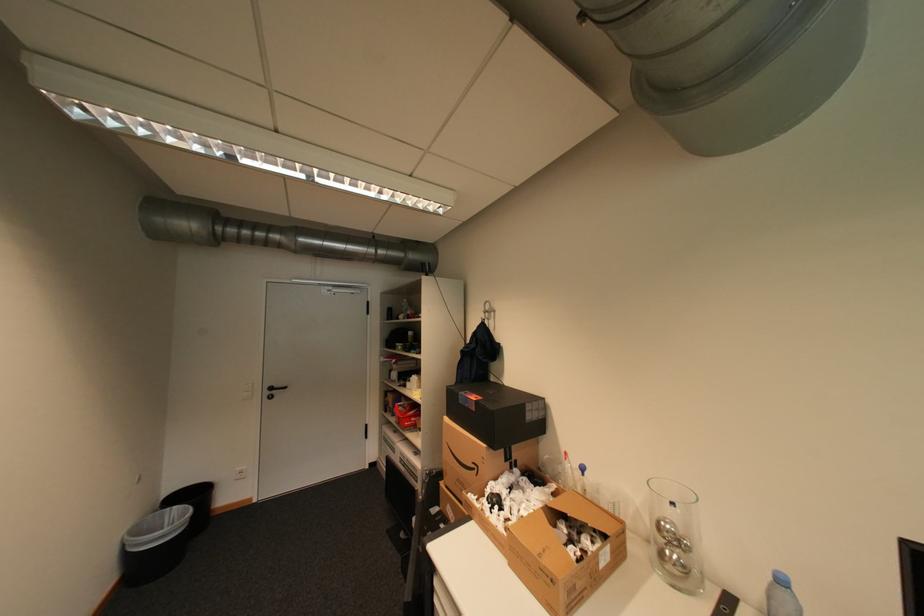
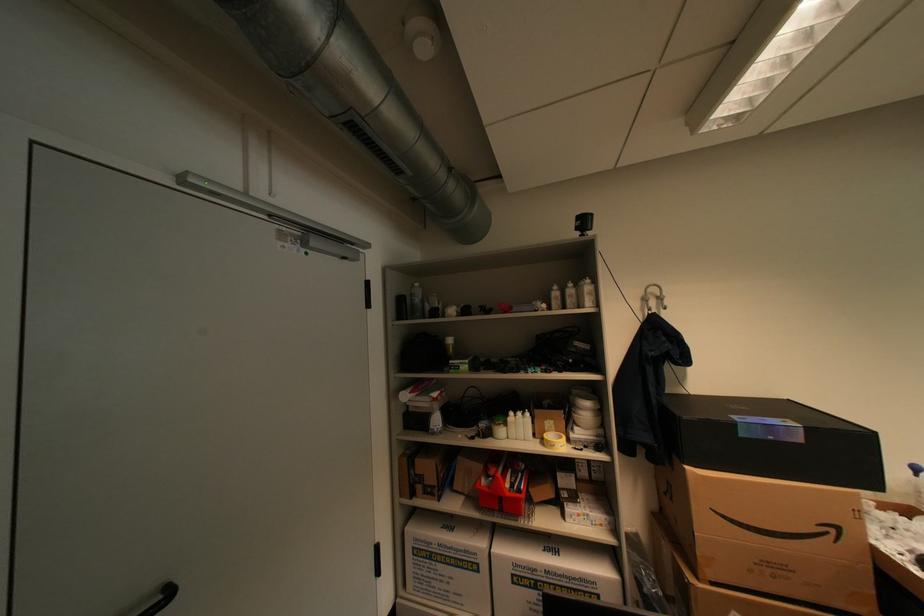
Where in the second image is the point corresponding to point (294, 387) from the first image?

(176, 594)